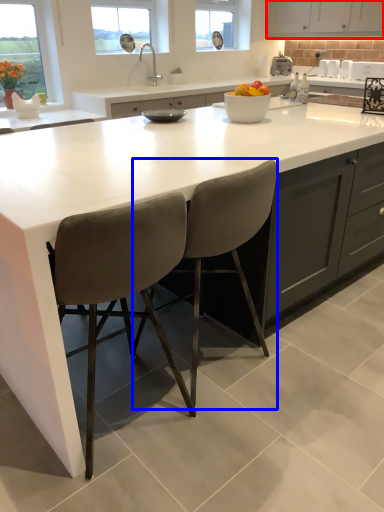
Question: Which object is closer to the camera taking this photo, cabinetry (highlighted by a red box) or chair (highlighted by a blue box)?

Choices:
 (A) cabinetry
 (B) chair

Answer: (B)